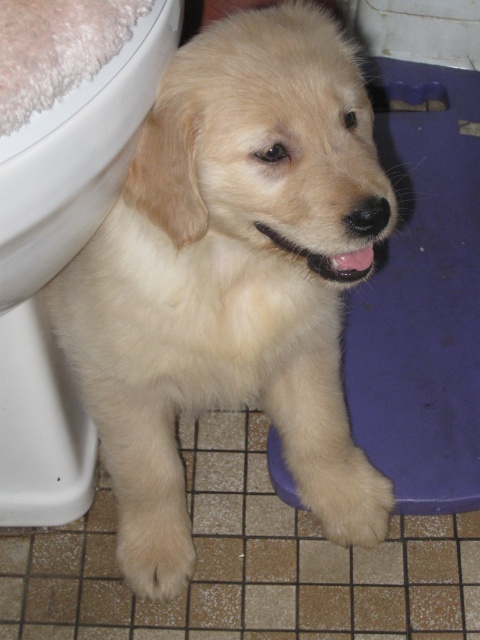
You are a dog trainer observing the golden retriever puppy in the scene. The puppy has two white fluffy paws visible. How far apart are the white fluffy paw at lower center and the white fluffy paw at lower left?

The white fluffy paw at lower center is 9.83 inches from the white fluffy paw at lower left.

You are a person who is 160 centimeters tall and standing in the room. You need to reach the white glossy toilet bowl at lower left to clean it. Considering your height, can you comfortably reach the toilet bowl without needing a stool?

The white glossy toilet bowl at lower left is 58.63 centimeters away from viewer. Since you are 160 centimeters tall, you can comfortably reach the toilet bowl without needing a stool because the distance is within a comfortable arm reach.